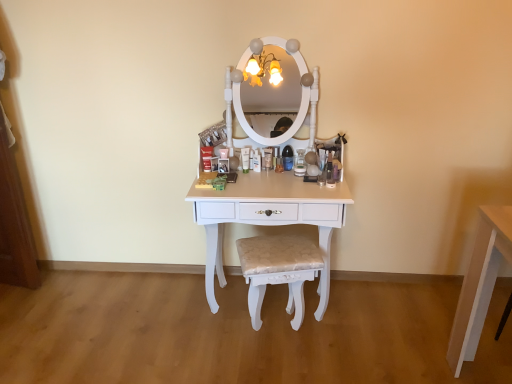
Question: Is matte white tube at center behind beige fabric cushioned stool at center?

Choices:
 (A) no
 (B) yes

Answer: (B)

Question: From the image's perspective, is matte white tube at center above beige fabric cushioned stool at center?

Choices:
 (A) yes
 (B) no

Answer: (A)

Question: Is beige fabric cushioned stool at center a part of matte white tube at center?

Choices:
 (A) yes
 (B) no

Answer: (B)

Question: Is matte white tube at center placed right next to beige fabric cushioned stool at center?

Choices:
 (A) no
 (B) yes

Answer: (A)

Question: From a real-world perspective, does matte white tube at center sit lower than beige fabric cushioned stool at center?

Choices:
 (A) yes
 (B) no

Answer: (B)

Question: Considering the positions of beige fabric cushioned stool at center and white glossy table at center in the image, is beige fabric cushioned stool at center bigger or smaller than white glossy table at center?

Choices:
 (A) small
 (B) big

Answer: (A)

Question: Considering their positions, is beige fabric cushioned stool at center located in front of or behind white glossy table at center?

Choices:
 (A) front
 (B) behind

Answer: (B)

Question: From the image's perspective, is beige fabric cushioned stool at center above or below white glossy table at center?

Choices:
 (A) below
 (B) above

Answer: (A)

Question: Would you say beige fabric cushioned stool at center is to the left or to the right of white glossy table at center in the picture?

Choices:
 (A) right
 (B) left

Answer: (A)

Question: Is matte white tube at center wider or thinner than white glossy table at center?

Choices:
 (A) thin
 (B) wide

Answer: (A)

Question: Considering the positions of matte white tube at center and white glossy table at center in the image, is matte white tube at center bigger or smaller than white glossy table at center?

Choices:
 (A) big
 (B) small

Answer: (B)

Question: Would you say matte white tube at center is inside or outside white glossy table at center?

Choices:
 (A) inside
 (B) outside

Answer: (B)

Question: From the image's perspective, is matte white tube at center above or below white glossy table at center?

Choices:
 (A) below
 (B) above

Answer: (B)

Question: Would you say white glossy table at center is to the left or to the right of matte white tube at center in the picture?

Choices:
 (A) right
 (B) left

Answer: (A)

Question: Is white glossy table at center wider or thinner than matte white tube at center?

Choices:
 (A) thin
 (B) wide

Answer: (B)